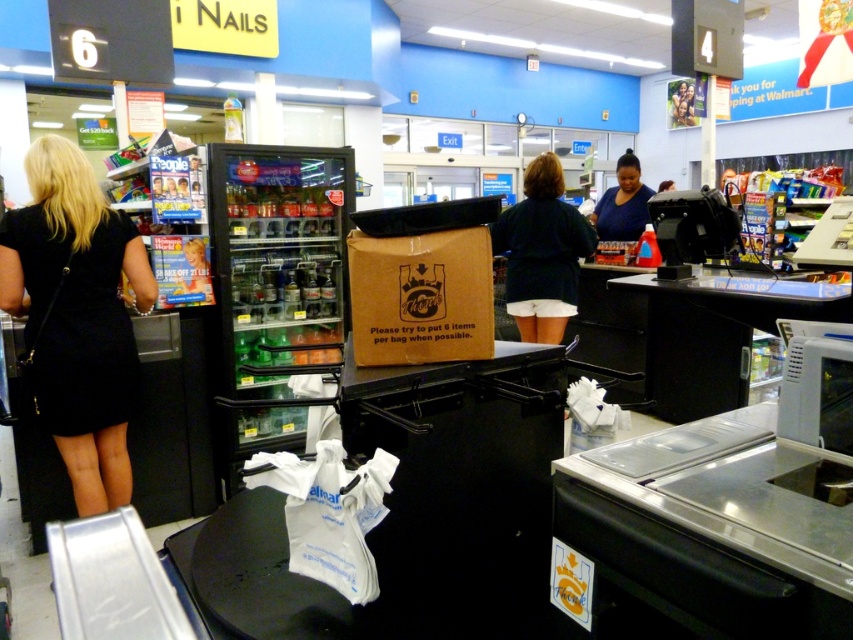
Does brown cardboard box at center appear under dark blue shirt at center?

Indeed, brown cardboard box at center is positioned under dark blue shirt at center.

Measure the distance between point (401,310) and camera.

Point (401,310) and camera are 5.08 feet apart from each other.

Which is behind, point (469, 296) or point (514, 305)?

The point (514, 305) is more distant.

Where is `brown cardboard box at center`? This screenshot has width=853, height=640. brown cardboard box at center is located at coordinates (421, 298).

Based on the photo, does black matte dress at left appear on the right side of brown cardboard box at center?

No, black matte dress at left is not to the right of brown cardboard box at center.

Between black matte dress at left and brown cardboard box at center, which one has less height?

With less height is brown cardboard box at center.

What are the coordinates of `black matte dress at left` in the screenshot? It's located at (76, 323).

Is the position of black matte dress at left more distant than that of blue matte shirt at center?

No, black matte dress at left is closer to the viewer.

I want to click on black matte dress at left, so click(76, 323).